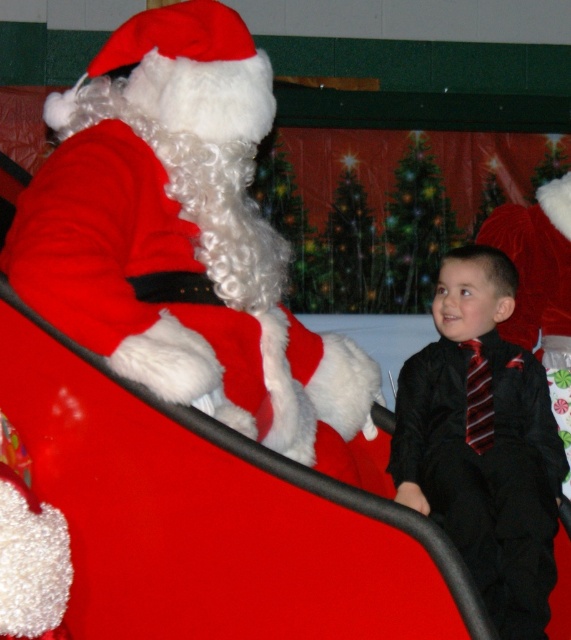
Is velvet red santa at upper left taller than black satin suit at right?

Correct, velvet red santa at upper left is much taller as black satin suit at right.

Which is above, velvet red santa at upper left or black satin suit at right?

velvet red santa at upper left is above.

Who is more distant from viewer, (144, 369) or (484, 324)?

The point (484, 324) is more distant.

Locate an element on the screen. Image resolution: width=571 pixels, height=640 pixels. velvet red santa at upper left is located at coordinates (183, 237).